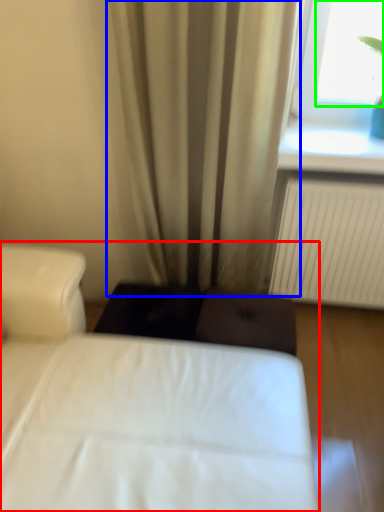
Question: Which object is positioned farthest from bed (highlighted by a red box)? Select from curtain (highlighted by a blue box) and window screen (highlighted by a green box).

Choices:
 (A) curtain
 (B) window screen

Answer: (B)